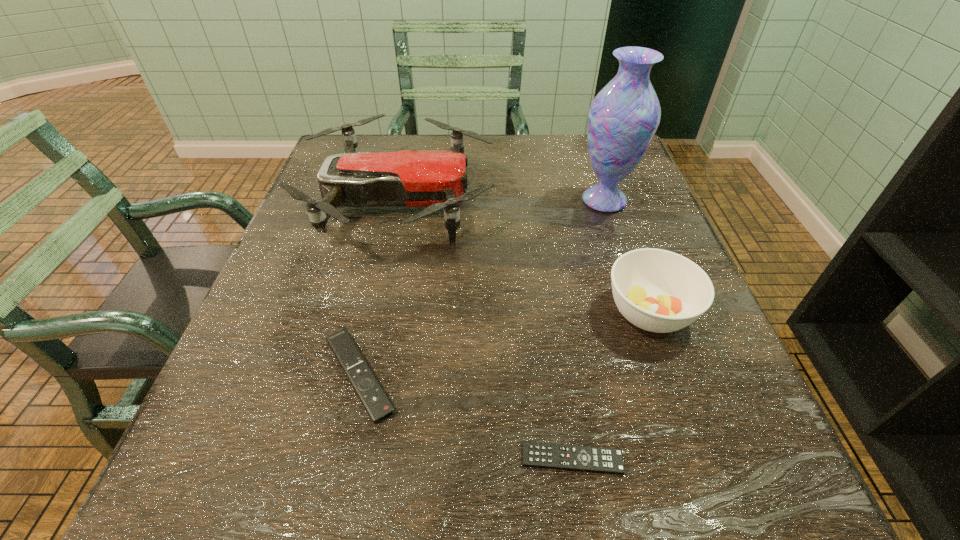
The image size is (960, 540). I want to click on vacant space positioned on the right of the left remote control, so click(x=458, y=375).

You are a GUI agent. You are given a task and a screenshot of the screen. Output one action in this format:
    pyautogui.click(x=<x>, y=<y>)
    Task: Click on the free location located 0.400m on the left of the shortest object
    
    Given the screenshot: What is the action you would take?
    pyautogui.click(x=229, y=458)

You are a GUI agent. You are given a task and a screenshot of the screen. Output one action in this format:
    pyautogui.click(x=<x>, y=<y>)
    Task: Click on the object that is at the far edge
    This screenshot has height=540, width=960.
    Given the screenshot: What is the action you would take?
    pyautogui.click(x=436, y=179)

Find the location of a particular element. object that is at the near edge is located at coordinates pos(535,454).

In order to click on drone present at the left edge in this screenshot , I will do pyautogui.click(x=436, y=179).

You are a GUI agent. You are given a task and a screenshot of the screen. Output one action in this format:
    pyautogui.click(x=<x>, y=<y>)
    Task: Click on the remote control at the left edge
    The height and width of the screenshot is (540, 960).
    Given the screenshot: What is the action you would take?
    pyautogui.click(x=375, y=401)

You are a GUI agent. You are given a task and a screenshot of the screen. Output one action in this format:
    pyautogui.click(x=<x>, y=<y>)
    Task: Click on the vase located at the right edge
    
    Given the screenshot: What is the action you would take?
    (623, 118)

The image size is (960, 540). Identify the location of soup bowl present at the right edge. (660, 291).

Where is `object situated at the far left corner`? object situated at the far left corner is located at coordinates (436, 179).

The image size is (960, 540). In order to click on vacant space at the far edge of the desktop in this screenshot , I will do `click(523, 164)`.